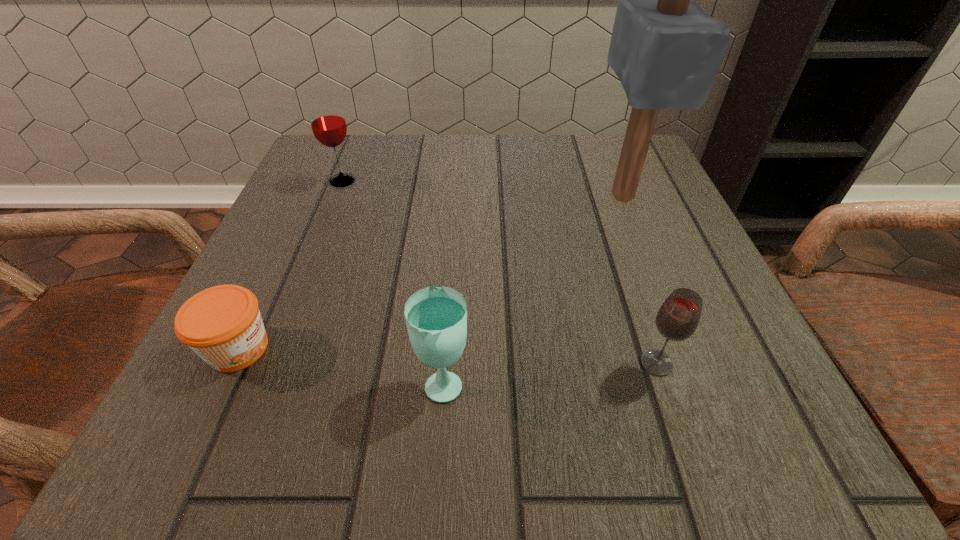
You are a GUI agent. You are given a task and a screenshot of the screen. Output one action in this format:
    pyautogui.click(x=<x>, y=<y>)
    Task: Click on the vacant space that satisfies the following two spatial constraints: 1. on the front label of the rightmost glass drink container; 2. on the right side of the shortest object
    
    Given the screenshot: What is the action you would take?
    pyautogui.click(x=231, y=363)

Where is `vacant space that satisfies the following two spatial constraints: 1. on the back side of the rightmost glass drink container; 2. on the front label of the jam`? The width and height of the screenshot is (960, 540). vacant space that satisfies the following two spatial constraints: 1. on the back side of the rightmost glass drink container; 2. on the front label of the jam is located at coordinates (652, 348).

Find the location of `free space that satisfies the following two spatial constraints: 1. on the front label of the shortest object; 2. on the left side of the rightmost glass drink container`. free space that satisfies the following two spatial constraints: 1. on the front label of the shortest object; 2. on the left side of the rightmost glass drink container is located at coordinates (231, 363).

What are the coordinates of `free location that satisfies the following two spatial constraints: 1. on the front side of the third object from right to left; 2. on the left side of the farthest glass drink container` in the screenshot? It's located at (263, 381).

This screenshot has width=960, height=540. I want to click on free space that satisfies the following two spatial constraints: 1. on the back side of the second glass drink container from left to right; 2. on the left side of the tallest object, so click(x=456, y=195).